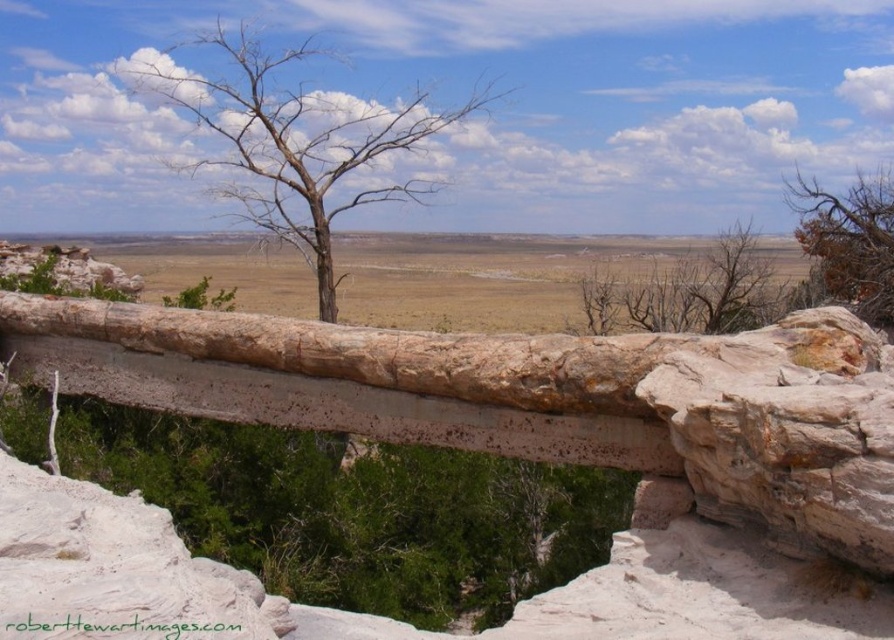
Question: Is brown bark tree at center positioned in front of brown/dry wood tree at upper right?

Choices:
 (A) yes
 (B) no

Answer: (B)

Question: Which object is the closest to the brown/dry wood tree at upper right?

Choices:
 (A) bare wood tree at center
 (B) brown bark tree at center

Answer: (B)

Question: Which of these objects is positioned closest to the brown/dry wood tree at upper right?

Choices:
 (A) brown bark tree at center
 (B) bare wood tree at center

Answer: (A)

Question: Can you confirm if brown bark tree at center is positioned to the right of brown/dry wood tree at upper right?

Choices:
 (A) yes
 (B) no

Answer: (B)

Question: Does bare wood tree at center have a smaller size compared to brown/dry wood tree at upper right?

Choices:
 (A) yes
 (B) no

Answer: (B)

Question: Which point is closer to the camera taking this photo?

Choices:
 (A) (849, 280)
 (B) (749, 260)

Answer: (A)